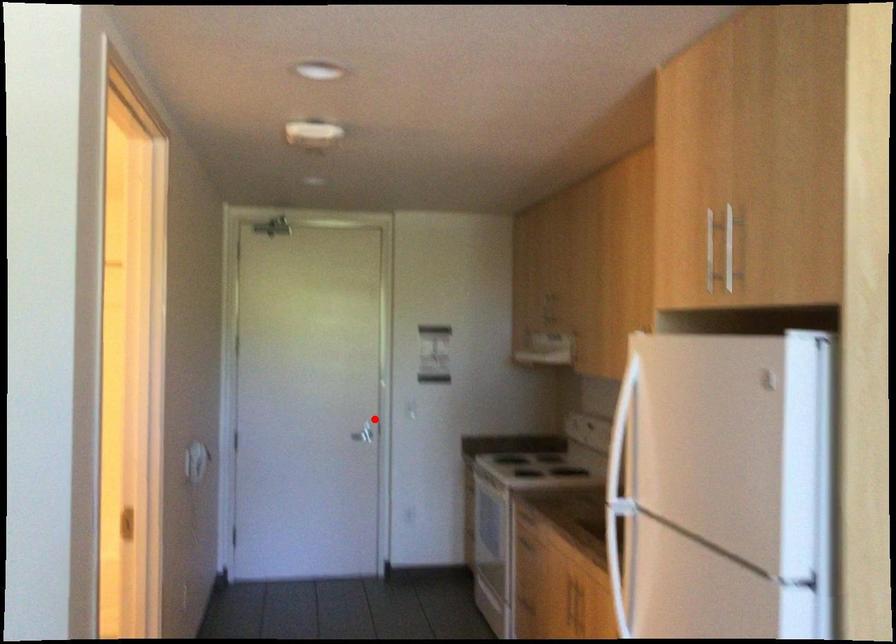
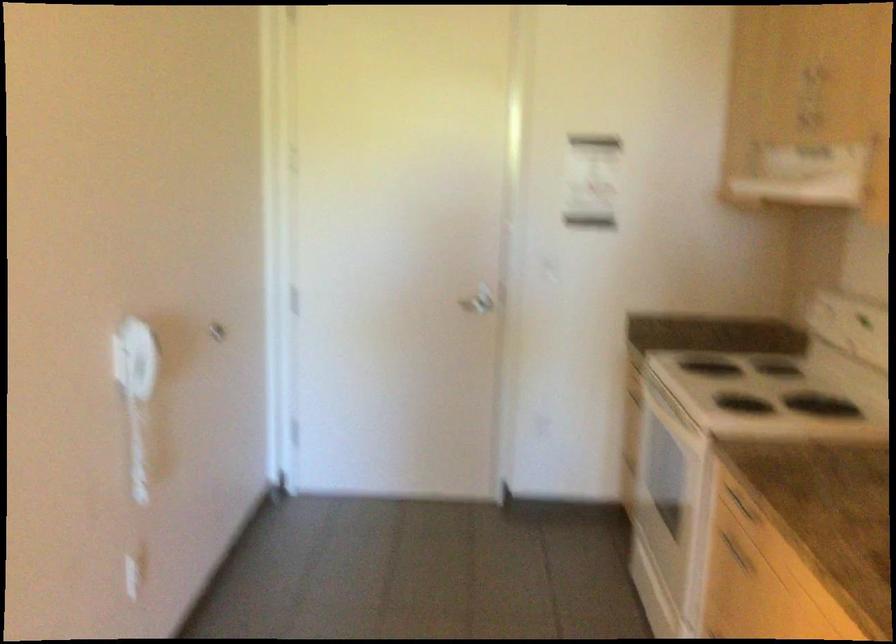
Locate, in the second image, the point that corresponds to the highlighted location in the first image.

(478, 301)